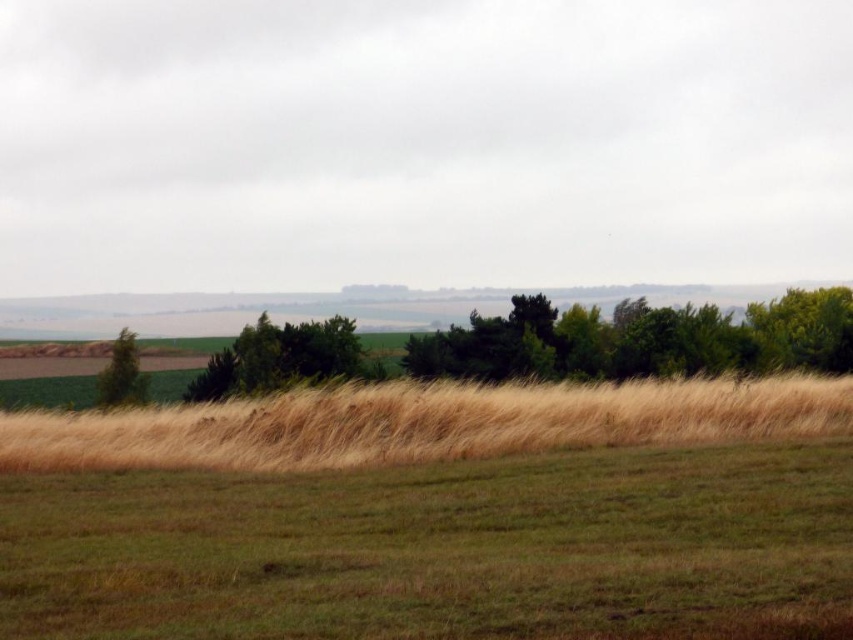
Question: Does dry grass at center come in front of green leafy tree at center?

Choices:
 (A) no
 (B) yes

Answer: (B)

Question: Is green leafy tree at center thinner than green leafy tree at right?

Choices:
 (A) no
 (B) yes

Answer: (B)

Question: Which object is positioned farthest from the green leafy tree at right?

Choices:
 (A) green matte tree at left
 (B) green leafy tree at center
 (C) green leafy trees at center

Answer: (A)

Question: Which object appears closest to the camera in this image?

Choices:
 (A) green matte tree at left
 (B) green leafy tree at center
 (C) green leafy tree at right

Answer: (B)

Question: From the image, what is the correct spatial relationship of green leafy trees at center in relation to green matte tree at left?

Choices:
 (A) below
 (B) above

Answer: (B)

Question: Which object is positioned closest to the green matte tree at left?

Choices:
 (A) green leafy tree at center
 (B) green leafy tree at right
 (C) dry grass at center

Answer: (A)